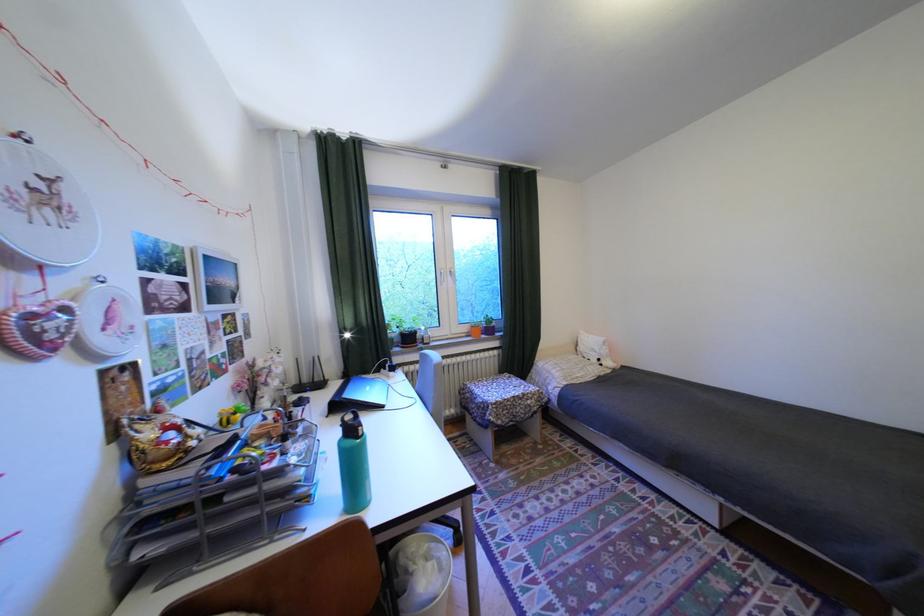
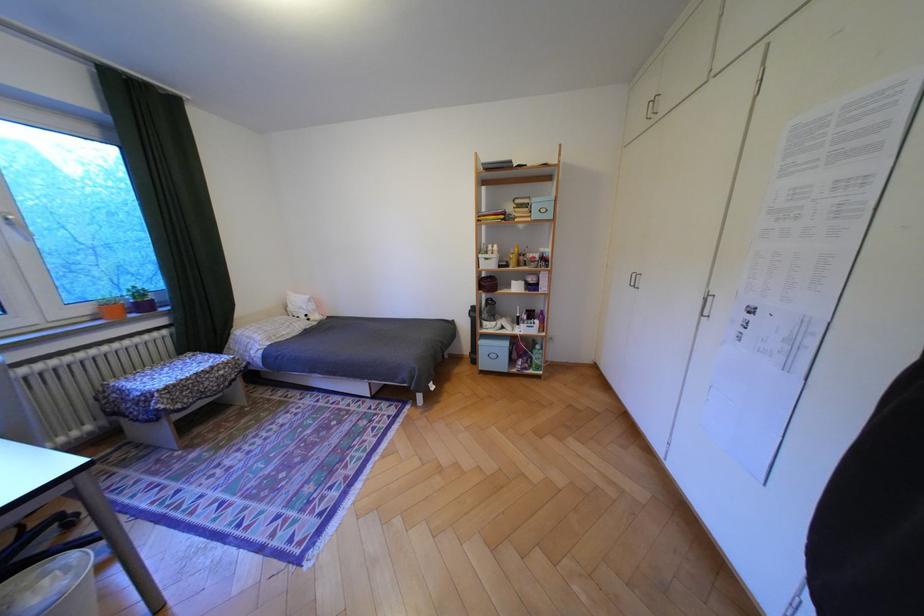
The point at (x=478, y=329) is marked in the first image. Where is the corresponding point in the second image?

(99, 310)